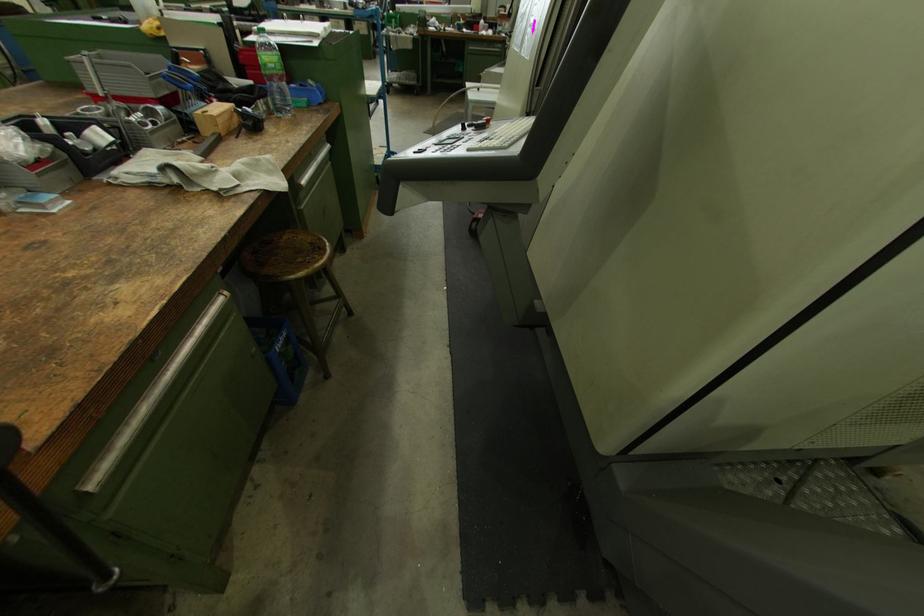
Locate an element on the screen. grey control button is located at coordinates (497, 139).